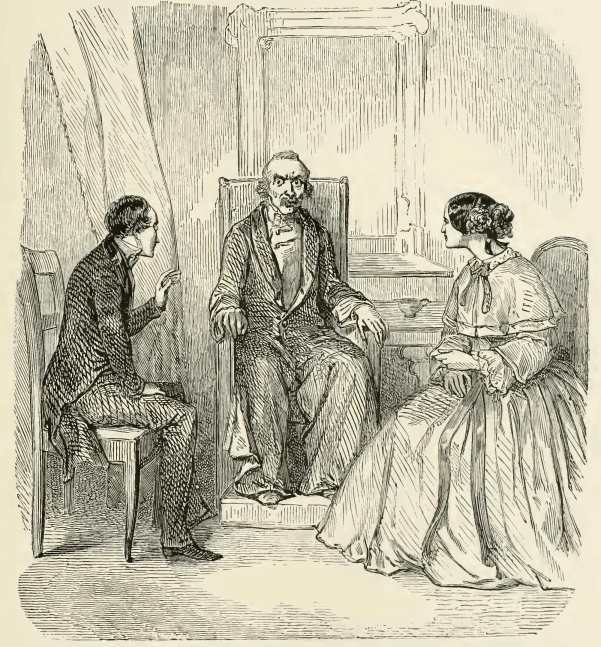
Locate an element on the screen. The height and width of the screenshot is (647, 601). chairs is located at coordinates (325, 201), (572, 264), (49, 261).